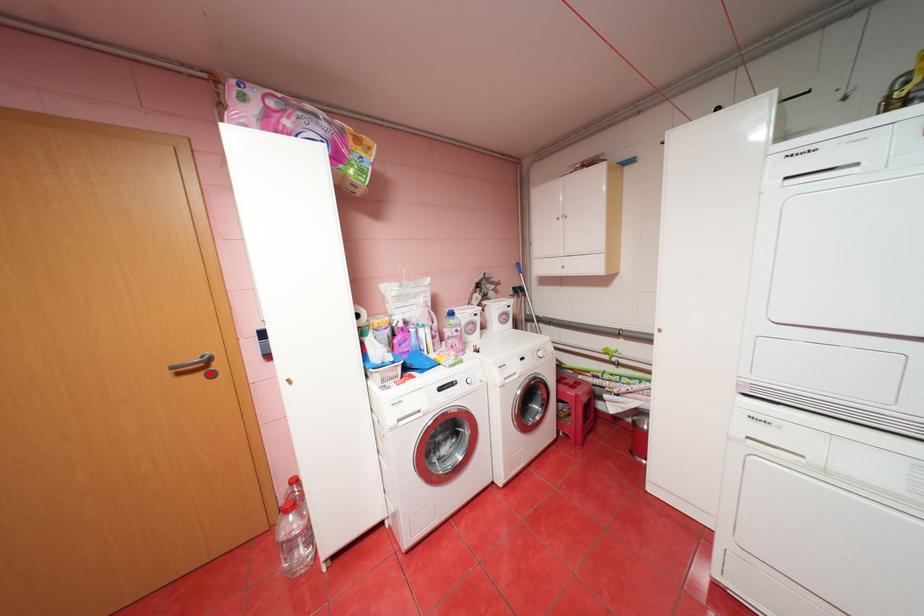
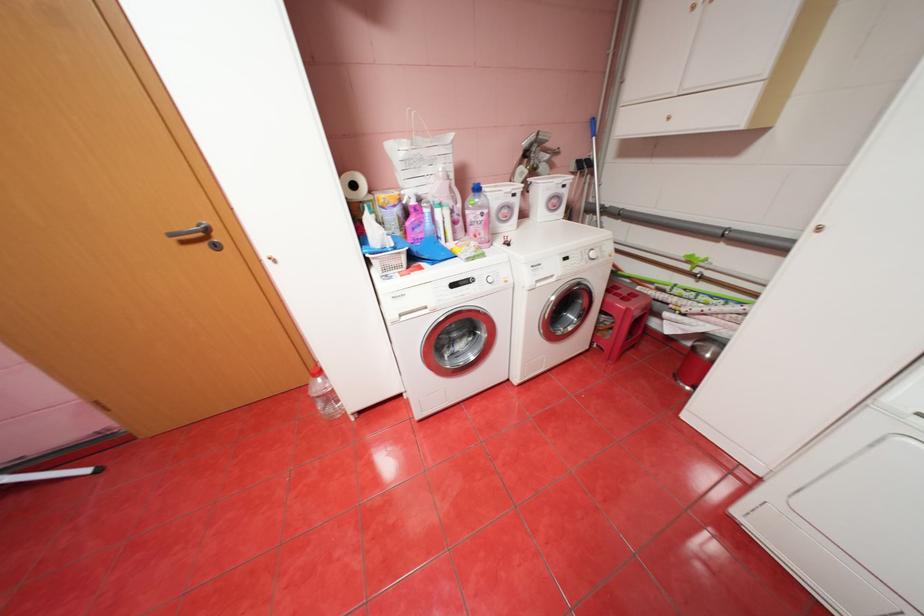
Locate, in the second image, the point that corresponds to the highlighted location in the first image.

(213, 245)